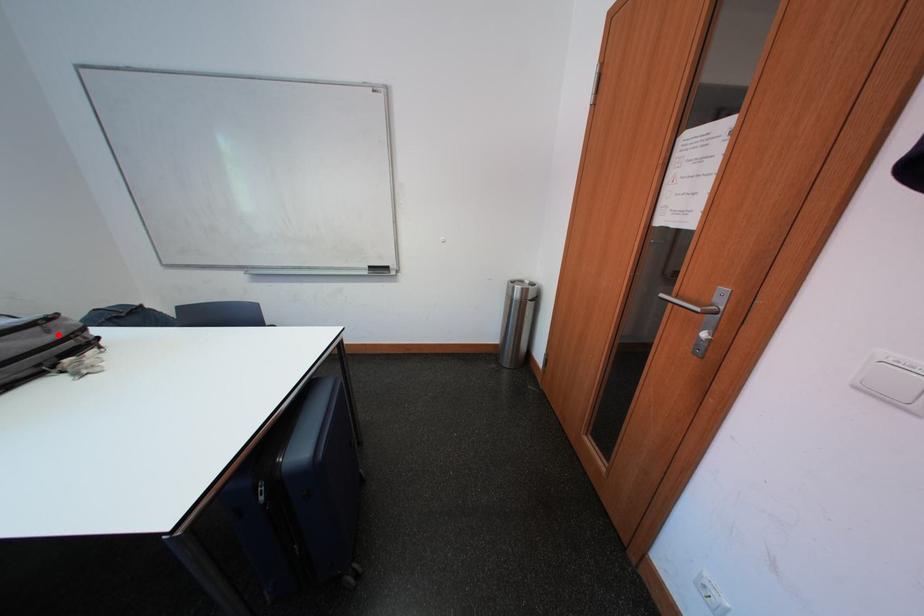
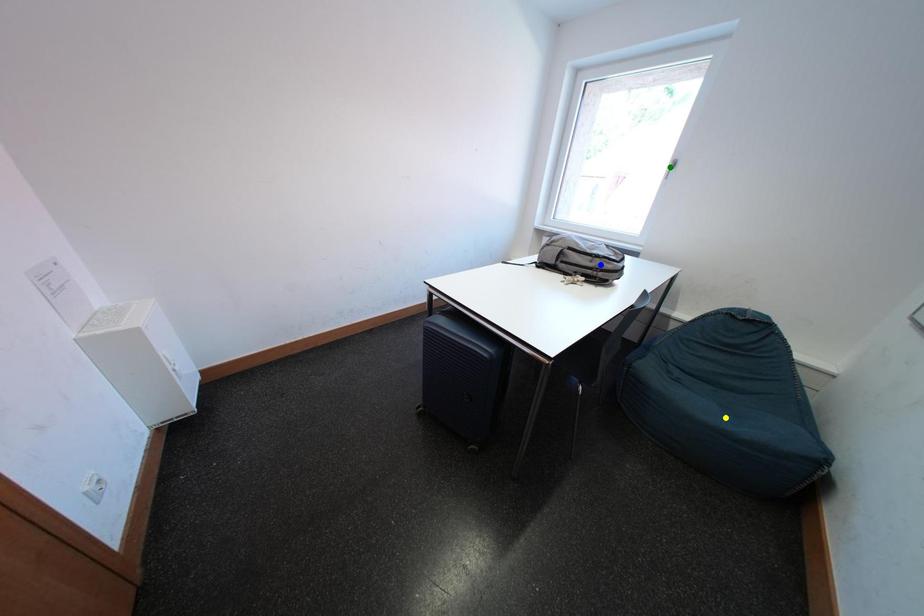
Question: I am providing you with two images of the same scene from different viewpoints. A red point is marked on the first image. You are given multiple points on the second image. Which spot in image 2 lines up with the point in image 1?

Choices:
 (A) green point
 (B) blue point
 (C) yellow point

Answer: (B)